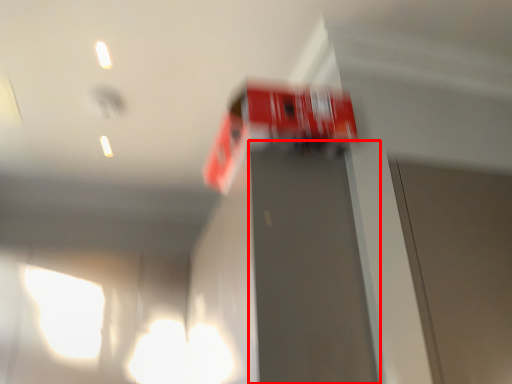
Question: Where is elevator door (annotated by the red box) located in relation to vehicle in the image?

Choices:
 (A) left
 (B) right

Answer: (A)